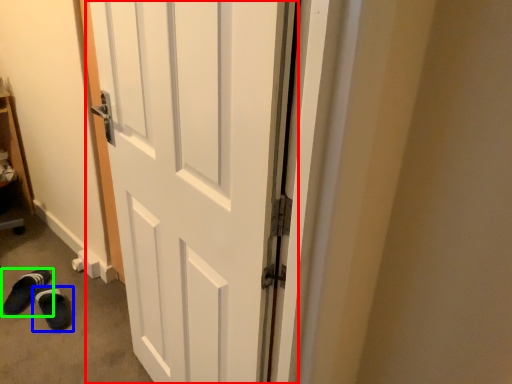
Question: Which object is positioned farthest from door (highlighted by a red box)? Select from footwear (highlighted by a blue box) and footwear (highlighted by a green box).

Choices:
 (A) footwear
 (B) footwear

Answer: (B)